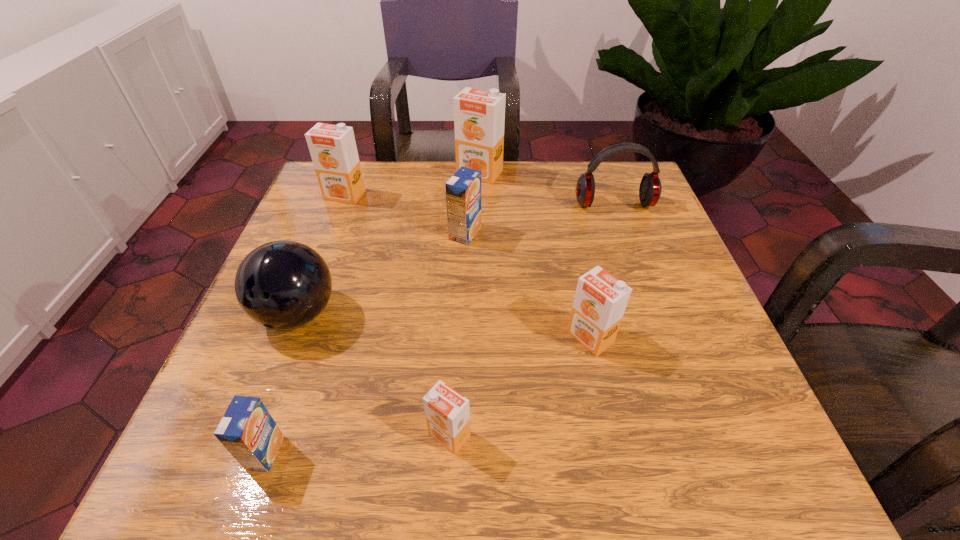
Find the location of a particular element. The width and height of the screenshot is (960, 540). the farthest orange orange juice is located at coordinates (479, 116).

Locate an element on the screen. the tallest object is located at coordinates (x=479, y=116).

The height and width of the screenshot is (540, 960). Identify the location of the leftmost orange orange juice. (333, 150).

Where is `the second biggest orange orange juice`? This screenshot has width=960, height=540. the second biggest orange orange juice is located at coordinates (333, 150).

Where is `earphone`? The image size is (960, 540). earphone is located at coordinates (650, 188).

Image resolution: width=960 pixels, height=540 pixels. I want to click on bowling ball, so click(x=283, y=284).

I want to click on the farther blue orange_juice, so click(463, 190).

The height and width of the screenshot is (540, 960). In order to click on the right blue orange_juice in this screenshot , I will do [463, 190].

The height and width of the screenshot is (540, 960). Find the location of `the third biggest orange orange juice`. the third biggest orange orange juice is located at coordinates (600, 300).

Identify the location of the second nearest orange orange juice. tap(600, 300).